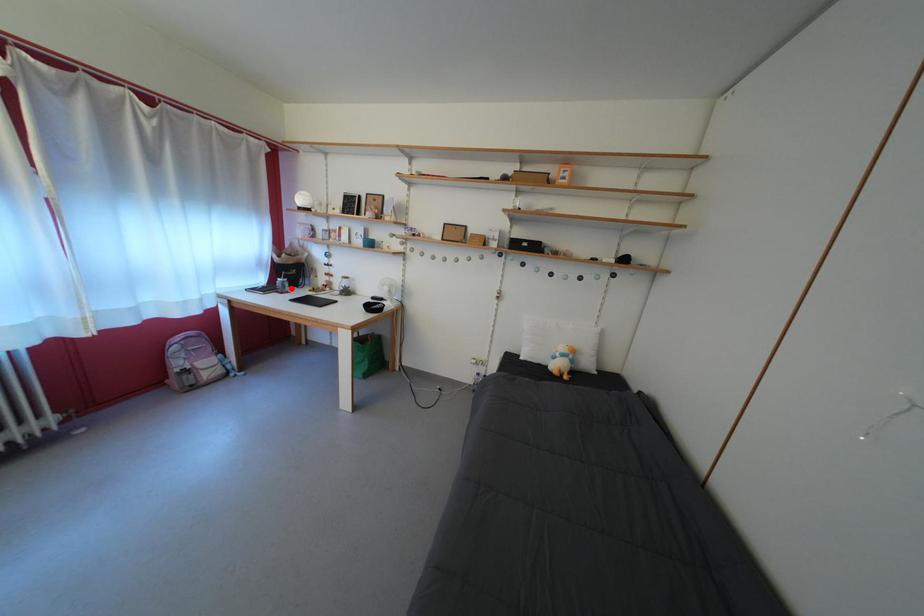
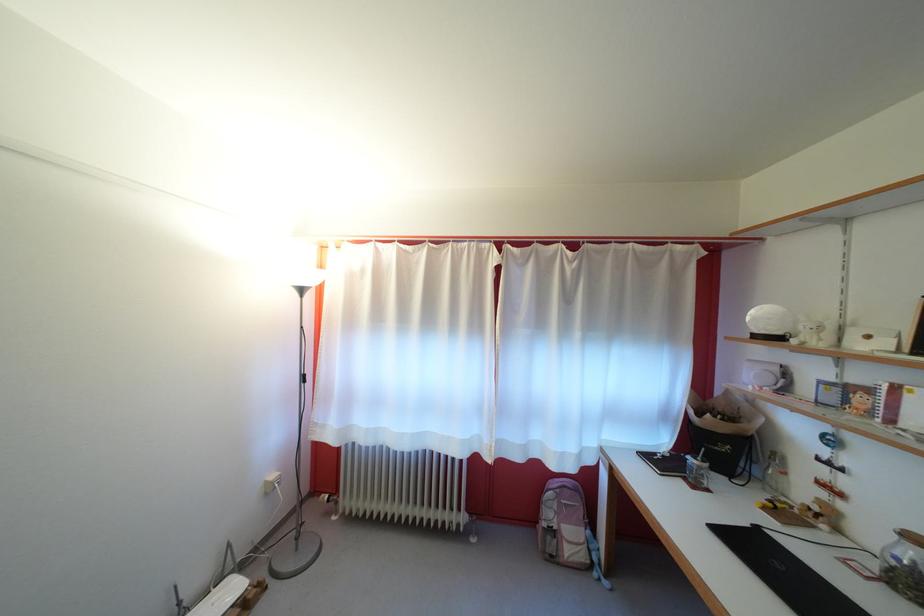
Question: I am providing you with two images of the same scene from different viewpoints. A red point is shown in image1. For the corresponding object point in image2, is it positioned nearer or farther from the camera?

Choices:
 (A) Nearer
 (B) Farther

Answer: (B)